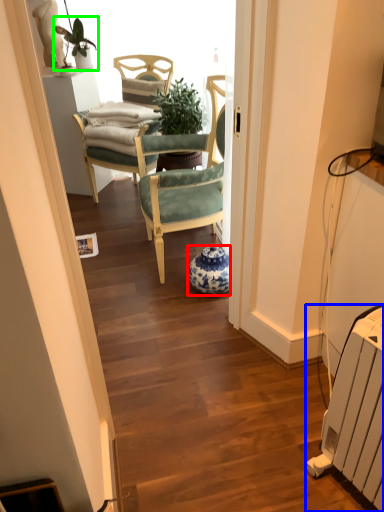
Question: Considering the real-world distances, which object is farthest from vase (highlighted by a red box)? radiator (highlighted by a blue box) or houseplant (highlighted by a green box)?

Choices:
 (A) radiator
 (B) houseplant

Answer: (B)